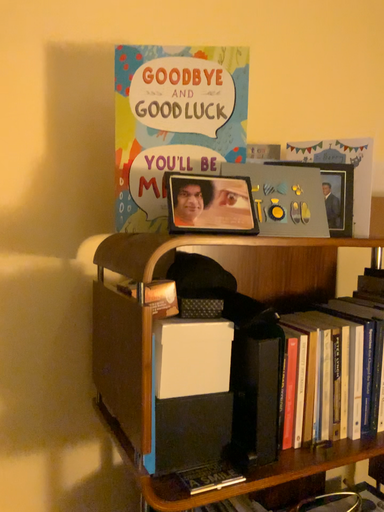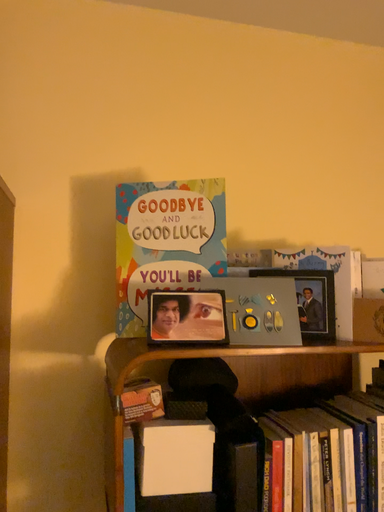
Question: How did the camera likely rotate when shooting the video?

Choices:
 (A) rotated left
 (B) rotated right

Answer: (A)